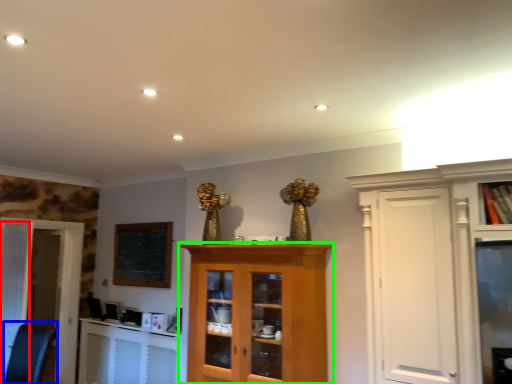
Question: Based on their relative distances, which object is nearer to door (highlighted by a red box)? Choose from swivel chair (highlighted by a blue box) and cupboard (highlighted by a green box).

Choices:
 (A) swivel chair
 (B) cupboard

Answer: (A)